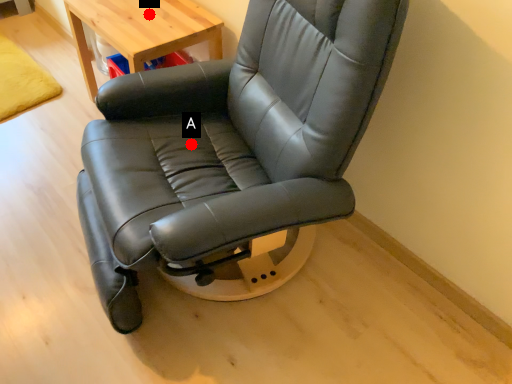
Question: Two points are circled on the image, labeled by A and B beside each circle. Which of the following is the farthest from the observer?

Choices:
 (A) A is further
 (B) B is further

Answer: (B)